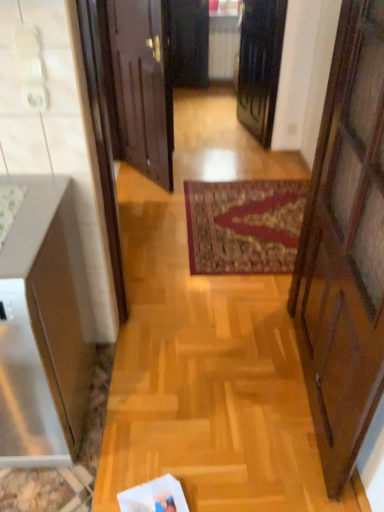
At what (x,y) coordinates should I click in order to perform the action: click on empty space that is to the right of matte white cabinet at left. Please return your answer as a coordinate pair (x, y). This screenshot has height=512, width=384. Looking at the image, I should click on (152, 399).